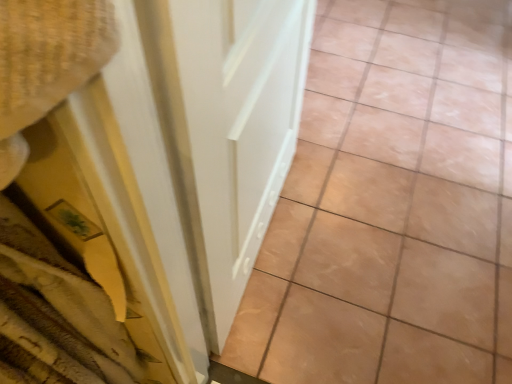
Question: Considering the relative positions of white glossy door at center and beige glossy tile at center in the image provided, is white glossy door at center to the left or to the right of beige glossy tile at center?

Choices:
 (A) left
 (B) right

Answer: (A)

Question: Would you say white glossy door at center is inside or outside beige glossy tile at center?

Choices:
 (A) outside
 (B) inside

Answer: (A)

Question: From the image's perspective, relative to beige glossy tile at center, is white glossy door at center above or below?

Choices:
 (A) below
 (B) above

Answer: (A)

Question: In the image, is beige glossy tile at center on the left side or the right side of white glossy door at center?

Choices:
 (A) right
 (B) left

Answer: (A)

Question: Relative to white glossy door at center, is beige glossy tile at center in front or behind?

Choices:
 (A) behind
 (B) front

Answer: (A)

Question: Looking at their shapes, would you say beige glossy tile at center is wider or thinner than white glossy door at center?

Choices:
 (A) wide
 (B) thin

Answer: (A)

Question: Is beige glossy tile at center inside or outside of white glossy door at center?

Choices:
 (A) outside
 (B) inside

Answer: (A)